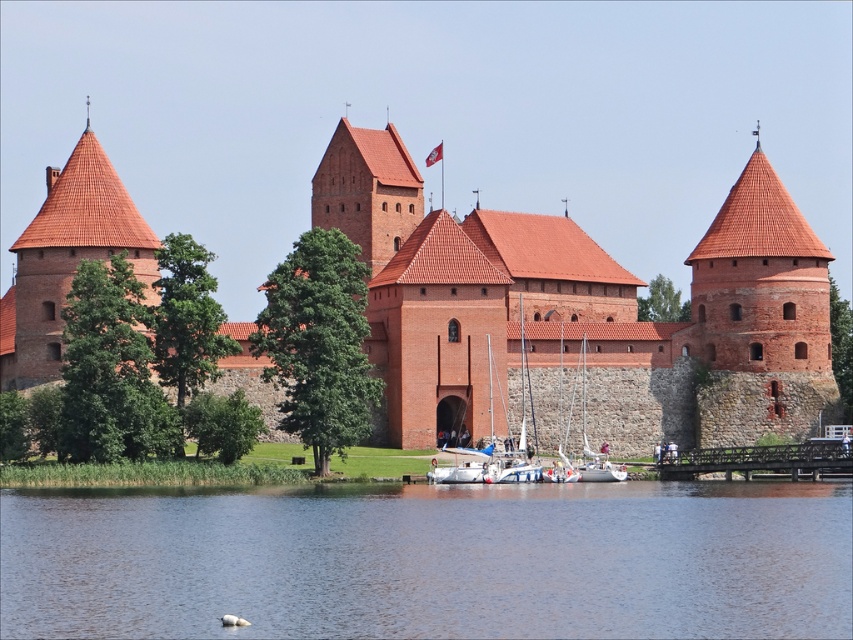
You are a tourist standing on the wooden bridge and looking towards the castle. Which brick tower, the brick tower at left or the brick tower at center, is positioned lower in the image?

The brick tower at left is positioned lower than the brick tower at center in the image.

You are standing on the wooden bridge and want to walk to the brick tower at left. Which direction should you go relative to the white sailboat at center?

You should head towards the brick tower at left, which is closer to you than the white sailboat at center, so move in the direction opposite to the white sailboat at center.

You are standing on the wooden bridge leading to Trakai Island Castle. You notice the brick tower at left and the white sailboat at center. From your vantage point, which object appears higher in the scene?

The brick tower at left appears higher in the scene than the white sailboat at center because the brick tower at left is above white sailboat at center.